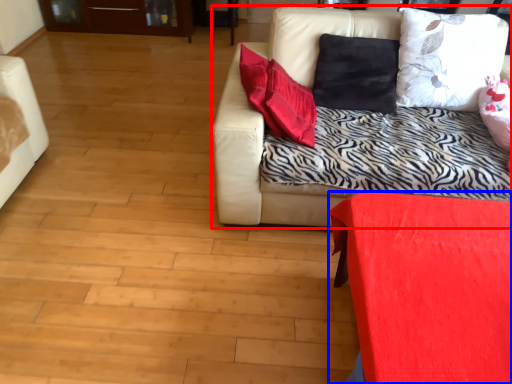
Question: Which object is further to the camera taking this photo, studio couch (highlighted by a red box) or furniture (highlighted by a blue box)?

Choices:
 (A) studio couch
 (B) furniture

Answer: (A)